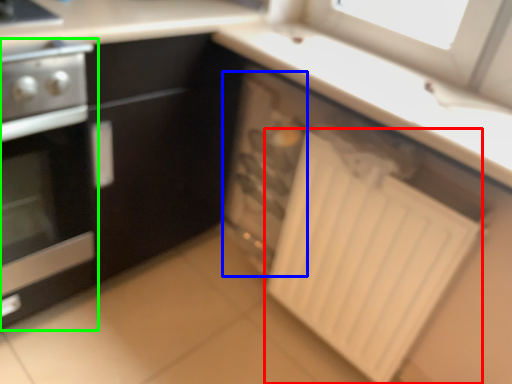
Question: Considering the real-world distances, which object is farthest from radiator (highlighted by a red box)? appliance (highlighted by a blue box) or home appliance (highlighted by a green box)?

Choices:
 (A) appliance
 (B) home appliance

Answer: (B)